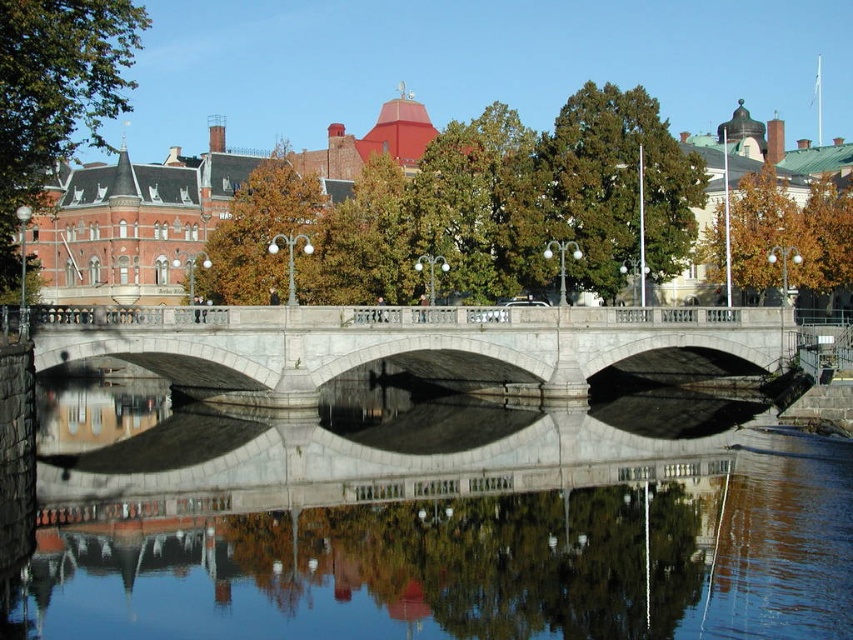
You are an architect analyzing the urban scene. You notice the gray stone bridge at center and the green textured tree at upper center. Which object appears smaller in the image?

The gray stone bridge at center appears smaller compared to the green textured tree at upper center in the image.

You are standing at the center of the image and want to locate the gray stone bridge at center. What are its coordinates?

The gray stone bridge at center is located at coordinates (422, 344).

You are standing at the stone bridge and want to locate two points marked on the image. The first point is at coordinate point(534, 288) and the second is at point(268, 212). Which point is closer to you?

Point(534, 288) is in front of point(268, 212), so it is closer to you.